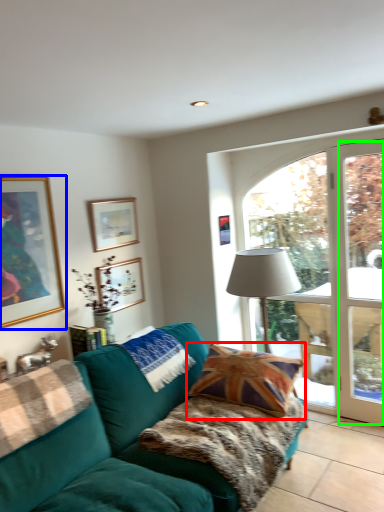
Question: Considering the real-world distances, which object is farthest from pillow (highlighted by a red box)? picture frame (highlighted by a blue box) or window frame (highlighted by a green box)?

Choices:
 (A) picture frame
 (B) window frame

Answer: (A)